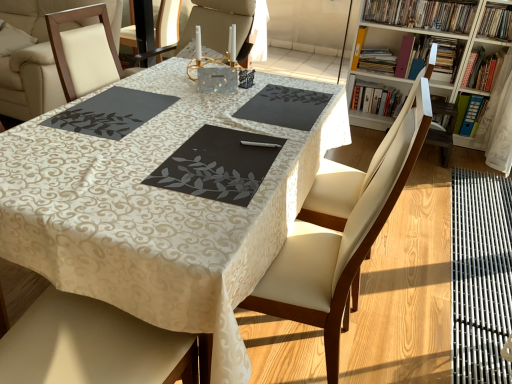
In order to click on free location above dark gray matte placemat at center, which appears as the 1th place mat when viewed from the left (from a real-world perspective) in this screenshot , I will do `click(124, 109)`.